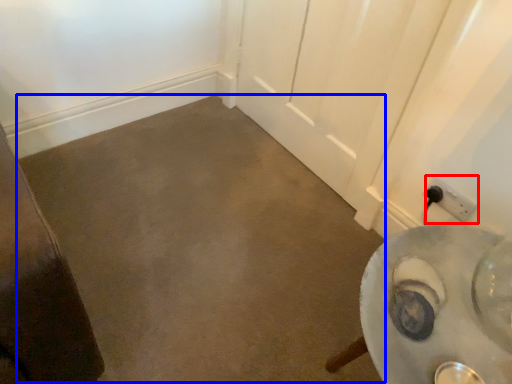
Question: Which object appears closest to the camera in this image, power plugs and sockets (highlighted by a red box) or concrete (highlighted by a blue box)?

Choices:
 (A) power plugs and sockets
 (B) concrete

Answer: (B)